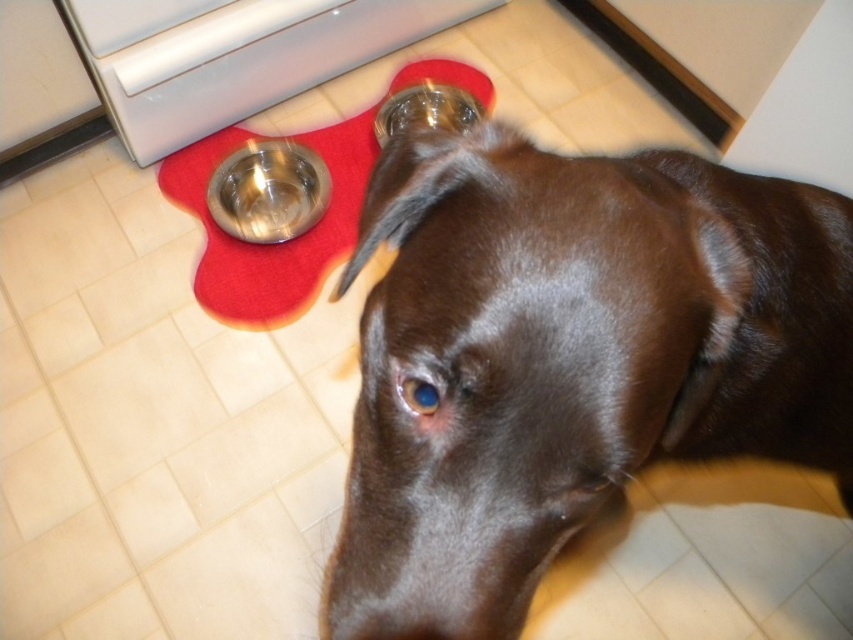
You are a dog owner who wants to ensure your chocolate Labrador can reach its food bowl placed near the white glossy oven at upper left. The dog has a neck length of 12 inches. Can the dog comfortably reach the bowl if it stands on its shiny brown fur at center?

The distance between the shiny brown fur at center and the white glossy oven at upper left is 4.28 feet. Since the dog has a neck length of 12 inches, which is 1 foot, the total reach would be 1 foot plus the dog standing on the shiny brown fur. However, the distance is 4.28 feet, so the dog would need to move closer or the bowl should be placed within 1 foot from the dog to be reachable.